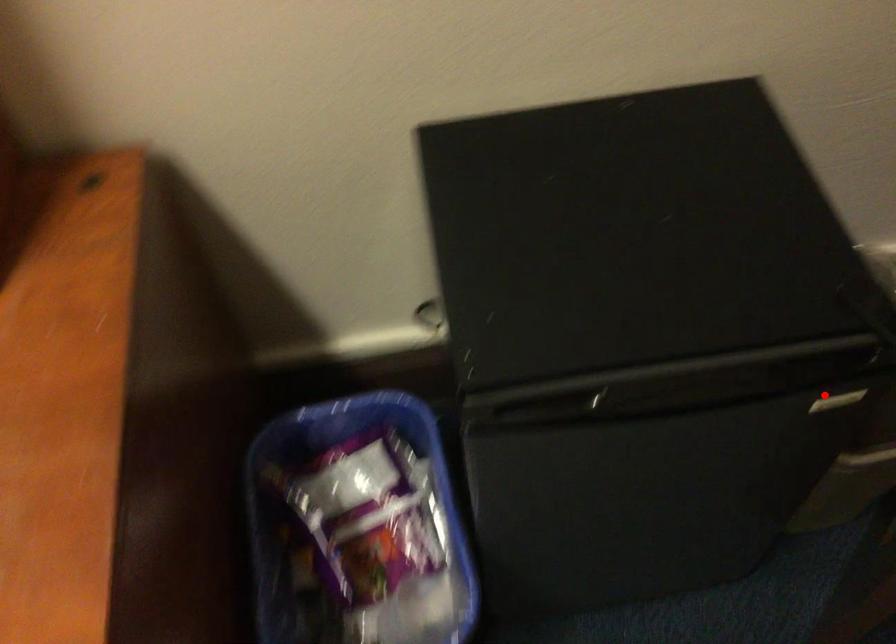
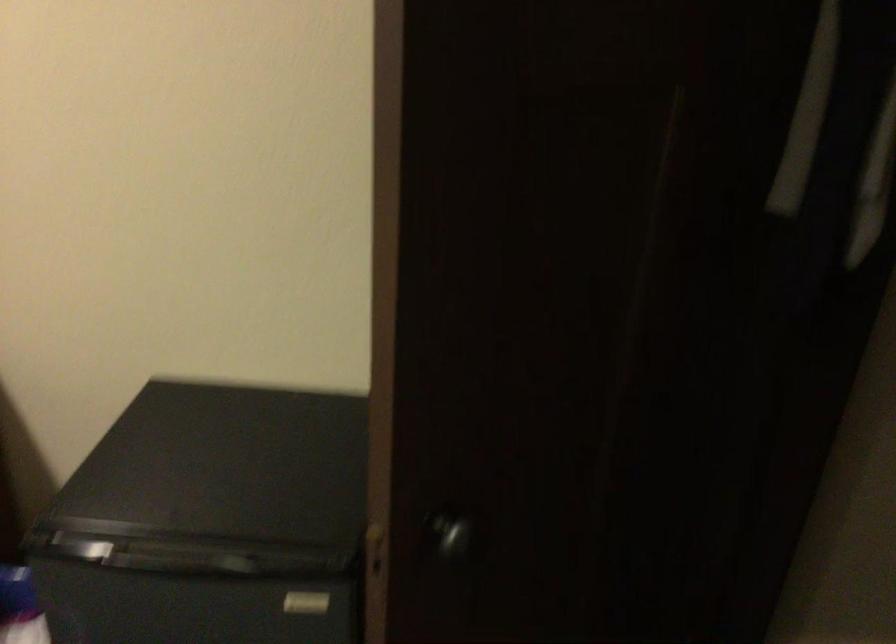
Question: A red point is marked in image1. In image2, is the corresponding 3D point closer to the camera or farther? Reply with the corresponding letter.

Choices:
 (A) The corresponding 3D point is closer.
 (B) The corresponding 3D point is farther.

Answer: (B)